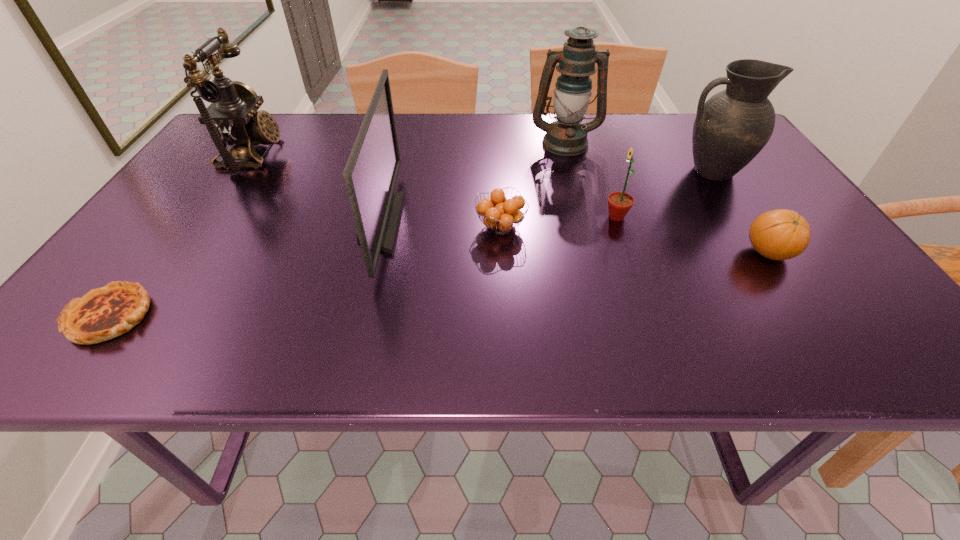
This screenshot has width=960, height=540. Identify the location of vacant space located 0.070m on the back of the oil lamp. (559, 119).

Identify the location of vacant region located on the rotary dial of the telephone. (425, 154).

In order to click on vacant space located 0.390m on the side of the pitcher with the handle in this screenshot , I will do `click(520, 171)`.

Locate an element on the screen. The image size is (960, 540). vacant region located on the side of the pitcher with the handle is located at coordinates (524, 171).

At what (x,y) coordinates should I click in order to perform the action: click on vacant region located 0.270m on the side of the pitcher with the handle. Please return your answer as a coordinate pair (x, y). Looking at the image, I should click on (568, 171).

Where is `free space located 0.390m on the screen side of the monitor`? The image size is (960, 540). free space located 0.390m on the screen side of the monitor is located at coordinates (575, 222).

Where is `free space located on the face of the sunflower`? Image resolution: width=960 pixels, height=540 pixels. free space located on the face of the sunflower is located at coordinates (528, 217).

The image size is (960, 540). Find the location of `blank space located on the face of the sunflower`. blank space located on the face of the sunflower is located at coordinates (461, 217).

Locate an element on the screen. free space located 0.320m on the face of the sunflower is located at coordinates (461, 217).

The width and height of the screenshot is (960, 540). In order to click on vacant space positioned on the back of the taller orange fruit in this screenshot , I will do `click(730, 195)`.